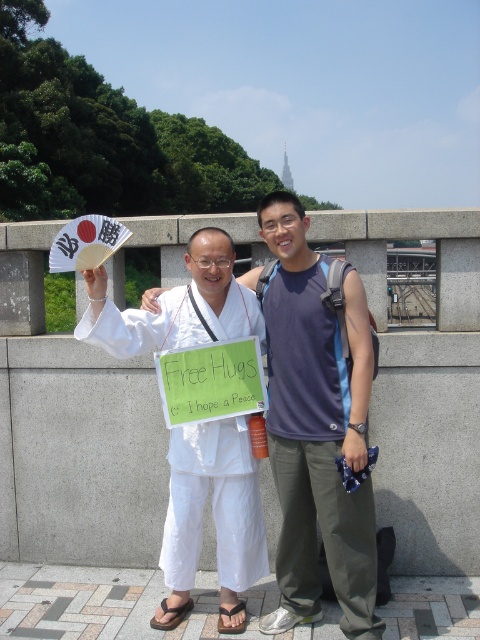
Question: Does white cotton kimono at center appear over matte gray tank top at center?

Choices:
 (A) no
 (B) yes

Answer: (A)

Question: Is white cotton kimono at center above matte gray tank top at center?

Choices:
 (A) yes
 (B) no

Answer: (B)

Question: Which point appears closest to the camera in this image?

Choices:
 (A) (316, 604)
 (B) (294, 376)

Answer: (B)

Question: Can you confirm if white cotton kimono at center is wider than matte gray tank top at center?

Choices:
 (A) yes
 (B) no

Answer: (A)